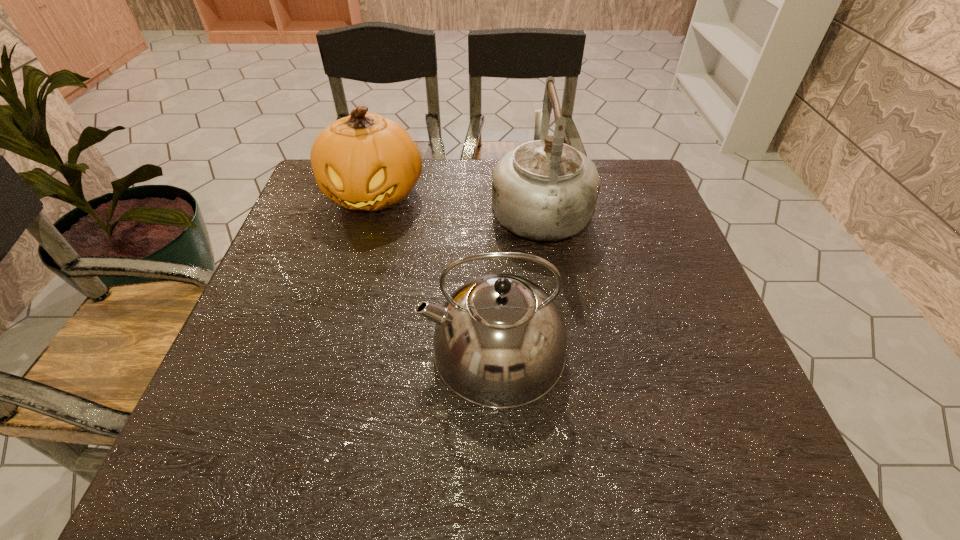
Identify the location of free point between the nearest object and the leftmost object. (433, 272).

At what (x,y) coordinates should I click in order to perform the action: click on unoccupied position between the leftmost object and the tallest object. Please return your answer as a coordinate pair (x, y). The width and height of the screenshot is (960, 540). Looking at the image, I should click on (457, 201).

This screenshot has height=540, width=960. I want to click on vacant space that's between the leftmost object and the nearest object, so click(433, 272).

Image resolution: width=960 pixels, height=540 pixels. What are the coordinates of `object that is the second closest to the leftmost object` in the screenshot? It's located at (500, 341).

You are a GUI agent. You are given a task and a screenshot of the screen. Output one action in this format:
    pyautogui.click(x=<x>, y=<y>)
    Task: Click on the second closest object to the taller kettle
    This screenshot has width=960, height=540.
    Given the screenshot: What is the action you would take?
    pyautogui.click(x=364, y=161)